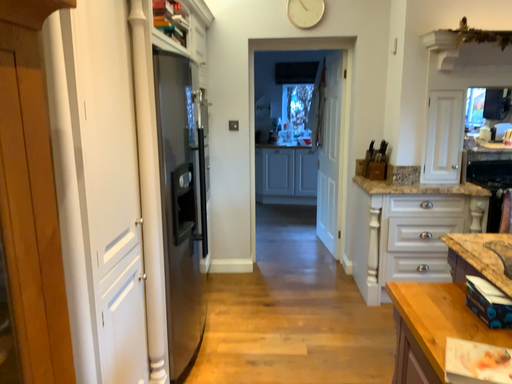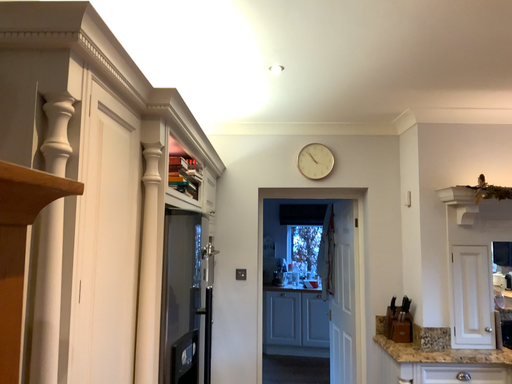
Question: How did the camera likely rotate when shooting the video?

Choices:
 (A) rotated downward
 (B) rotated upward

Answer: (B)